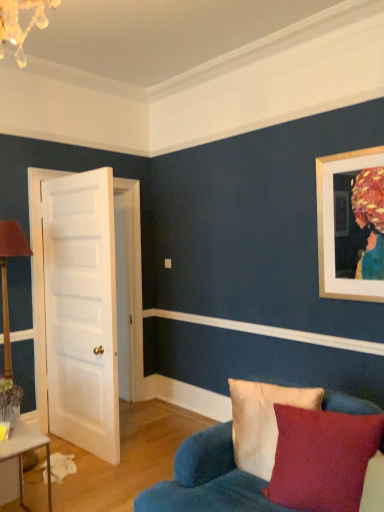
Question: From the image's perspective, does velvet blue couch at lower right appear lower than velvety red pillow at lower right, the 2th pillow when ordered from back to front?

Choices:
 (A) no
 (B) yes

Answer: (B)

Question: Does velvet blue couch at lower right have a greater width compared to velvety red pillow at lower right, the 2th pillow when ordered from back to front?

Choices:
 (A) yes
 (B) no

Answer: (A)

Question: Is velvet blue couch at lower right looking in the opposite direction of velvety red pillow at lower right, the first pillow in the front-to-back sequence?

Choices:
 (A) no
 (B) yes

Answer: (B)

Question: Is velvet blue couch at lower right taller than velvety red pillow at lower right, the first pillow in the front-to-back sequence?

Choices:
 (A) yes
 (B) no

Answer: (A)

Question: From a real-world perspective, is velvet blue couch at lower right over velvety red pillow at lower right, the first pillow in the front-to-back sequence?

Choices:
 (A) no
 (B) yes

Answer: (A)

Question: Is velvet blue couch at lower right completely or partially outside of velvety red pillow at lower right, the first pillow in the front-to-back sequence?

Choices:
 (A) yes
 (B) no

Answer: (A)

Question: Are velvet beige pillow at lower right, the 2th pillow in the front-to-back sequence, and velvet blue couch at lower right located far from each other?

Choices:
 (A) yes
 (B) no

Answer: (B)

Question: Does velvet beige pillow at lower right, the 2th pillow in the front-to-back sequence, have a lesser width compared to velvet blue couch at lower right?

Choices:
 (A) yes
 (B) no

Answer: (A)

Question: Does velvet beige pillow at lower right, marked as the first pillow in a back-to-front arrangement, lie in front of velvet blue couch at lower right?

Choices:
 (A) yes
 (B) no

Answer: (B)

Question: Considering the relative positions of velvet beige pillow at lower right, marked as the first pillow in a back-to-front arrangement, and velvet blue couch at lower right in the image provided, is velvet beige pillow at lower right, marked as the first pillow in a back-to-front arrangement, to the left of velvet blue couch at lower right from the viewer's perspective?

Choices:
 (A) yes
 (B) no

Answer: (A)

Question: From the image's perspective, would you say velvet beige pillow at lower right, the 2th pillow in the front-to-back sequence, is shown under velvet blue couch at lower right?

Choices:
 (A) no
 (B) yes

Answer: (A)

Question: Is velvet beige pillow at lower right, the 2th pillow in the front-to-back sequence, next to velvet blue couch at lower right and touching it?

Choices:
 (A) no
 (B) yes

Answer: (A)

Question: Is velvet beige pillow at lower right, the 2th pillow in the front-to-back sequence, placed right next to white smooth door at left?

Choices:
 (A) yes
 (B) no

Answer: (B)